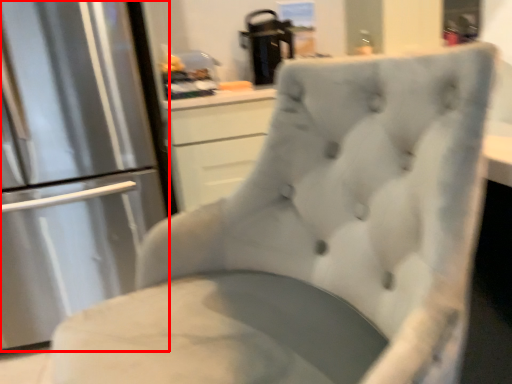
Question: From the image's perspective, where is refrigerator (annotated by the red box) located in relation to appliance in the image?

Choices:
 (A) below
 (B) above

Answer: (A)